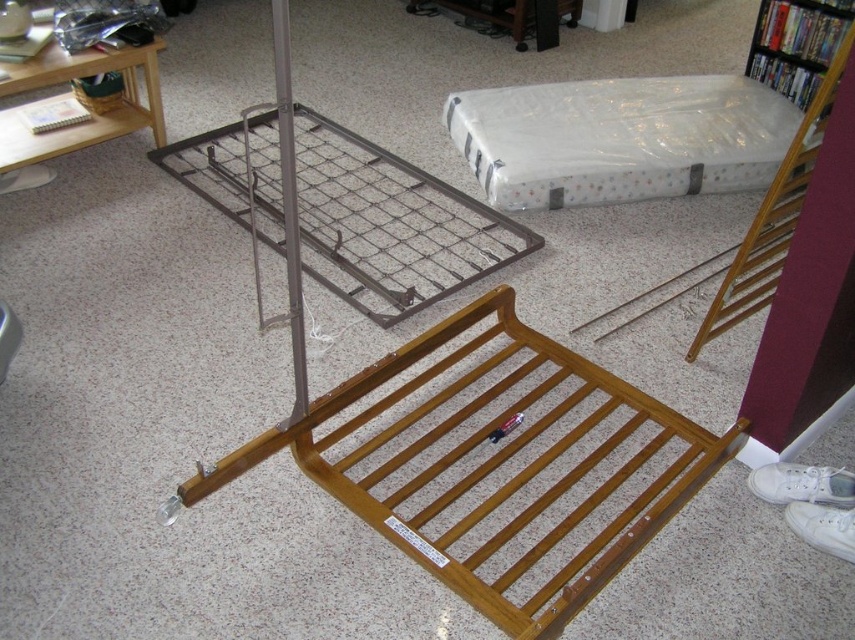
Is point (504, 348) closer to camera compared to point (690, 168)?

Yes, point (504, 348) is closer to viewer.

Is point (426, 557) farther from viewer compared to point (638, 177)?

No, it is in front of (638, 177).

Where is `wooden slatted bed frame at center`? wooden slatted bed frame at center is located at coordinates (497, 465).

Which is in front, point (673, 124) or point (781, 77)?

Point (673, 124)

Is white plastic mattress at upper right closer to camera compared to wooden bookshelf at upper right?

Yes.

What do you see at coordinates (620, 138) in the screenshot? Image resolution: width=855 pixels, height=640 pixels. I see `white plastic mattress at upper right` at bounding box center [620, 138].

Where is `white plastic mattress at upper right`? white plastic mattress at upper right is located at coordinates (620, 138).

Is point (546, 355) positioned in front of point (759, 38)?

Yes, it is.

Image resolution: width=855 pixels, height=640 pixels. What are the coordinates of `wooden slatted bed frame at center` in the screenshot? It's located at (497, 465).